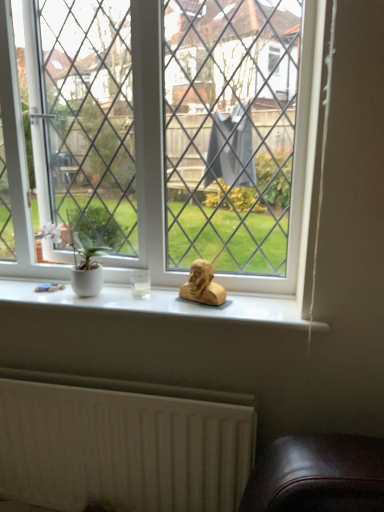
Question: Is white textured radiator at lower left shorter than clear glass window at center?

Choices:
 (A) no
 (B) yes

Answer: (B)

Question: Is white textured radiator at lower left positioned with its back to clear glass window at center?

Choices:
 (A) no
 (B) yes

Answer: (A)

Question: Considering the relative positions of white textured radiator at lower left and clear glass window at center in the image provided, is white textured radiator at lower left to the left of clear glass window at center from the viewer's perspective?

Choices:
 (A) no
 (B) yes

Answer: (B)

Question: Is the depth of white textured radiator at lower left less than that of clear glass window at center?

Choices:
 (A) yes
 (B) no

Answer: (B)

Question: From a real-world perspective, is white textured radiator at lower left physically below clear glass window at center?

Choices:
 (A) yes
 (B) no

Answer: (A)

Question: Looking at the image, does clear glass window at center seem bigger or smaller compared to white textured radiator at lower left?

Choices:
 (A) small
 (B) big

Answer: (B)

Question: Would you say clear glass window at center is inside or outside white textured radiator at lower left?

Choices:
 (A) outside
 (B) inside

Answer: (A)

Question: Is clear glass window at center in front of or behind white textured radiator at lower left in the image?

Choices:
 (A) front
 (B) behind

Answer: (A)

Question: From the image's perspective, relative to white textured radiator at lower left, is clear glass window at center above or below?

Choices:
 (A) above
 (B) below

Answer: (A)

Question: Is matte gold bust at center spatially inside white textured radiator at lower left, or outside of it?

Choices:
 (A) inside
 (B) outside

Answer: (B)

Question: Relative to white textured radiator at lower left, is matte gold bust at center in front or behind?

Choices:
 (A) behind
 (B) front

Answer: (A)

Question: From a real-world perspective, is matte gold bust at center physically located above or below white textured radiator at lower left?

Choices:
 (A) above
 (B) below

Answer: (A)

Question: Based on their sizes in the image, would you say matte gold bust at center is bigger or smaller than white textured radiator at lower left?

Choices:
 (A) small
 (B) big

Answer: (A)

Question: In terms of width, does matte gold bust at center look wider or thinner when compared to clear glass window at center?

Choices:
 (A) wide
 (B) thin

Answer: (B)

Question: From a real-world perspective, is matte gold bust at center above or below clear glass window at center?

Choices:
 (A) below
 (B) above

Answer: (A)